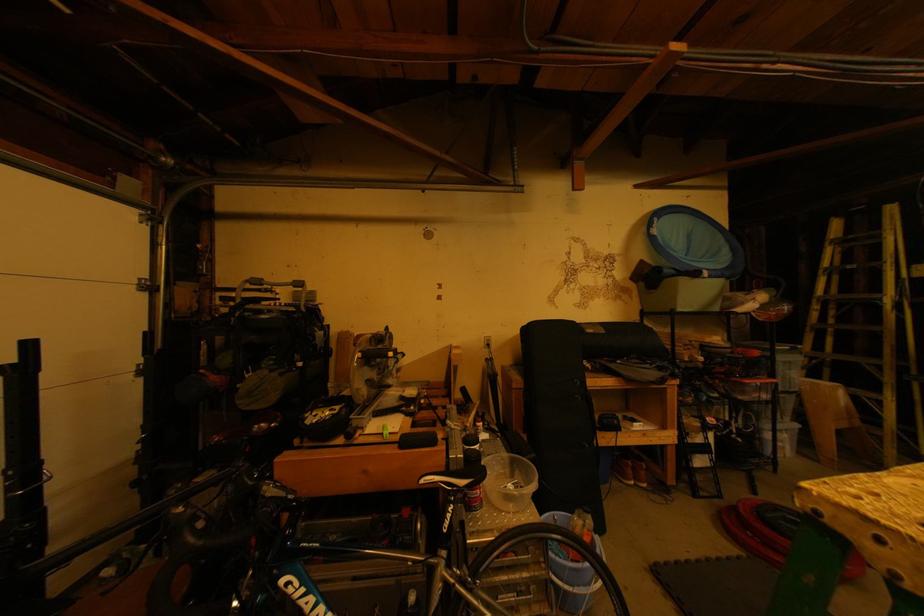
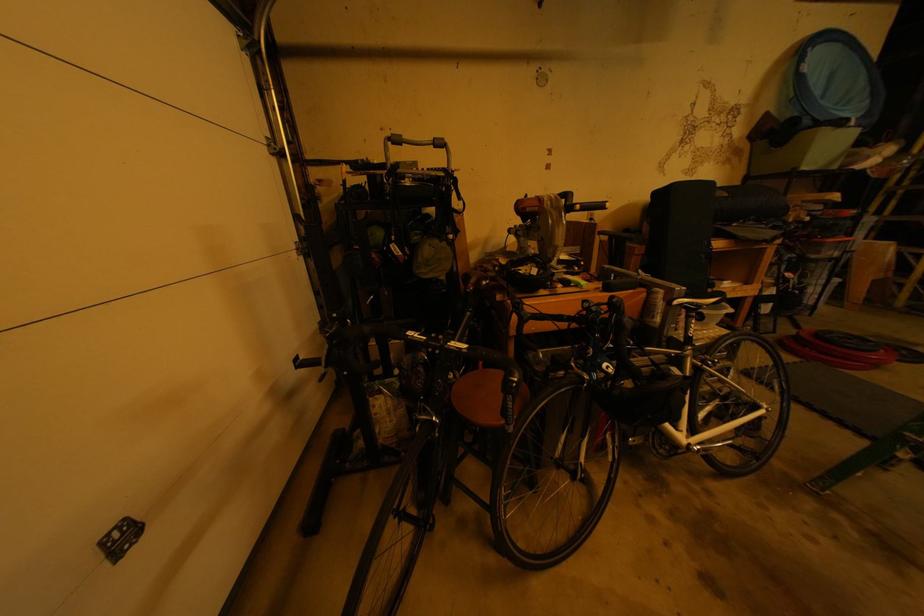
Question: In a continuous first-person perspective shot, in which direction is the camera moving?

Choices:
 (A) Left
 (B) Right
 (C) Forward
 (D) Backward

Answer: (A)